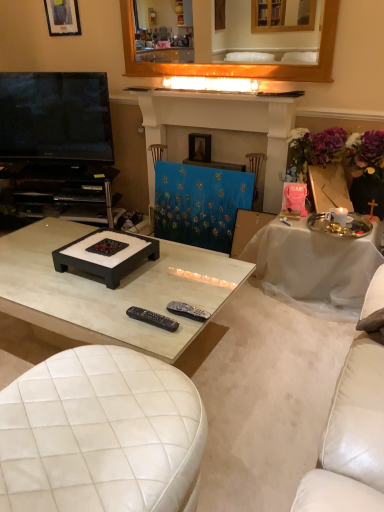
This screenshot has width=384, height=512. I want to click on vacant area on top of white glossy coffee table at center (from a real-world perspective), so click(90, 278).